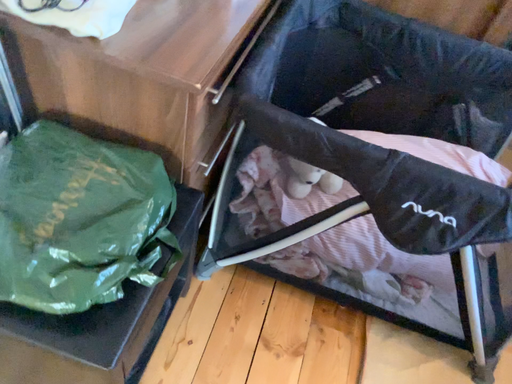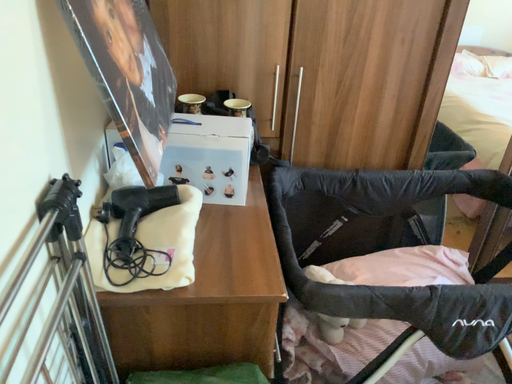
Question: How did the camera likely rotate when shooting the video?

Choices:
 (A) rotated downward
 (B) rotated upward

Answer: (B)